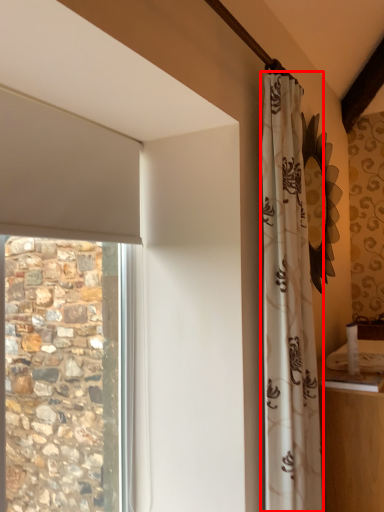
Question: Observing the image, what is the correct spatial positioning of curtain (annotated by the red box) in reference to counter top?

Choices:
 (A) right
 (B) left

Answer: (B)